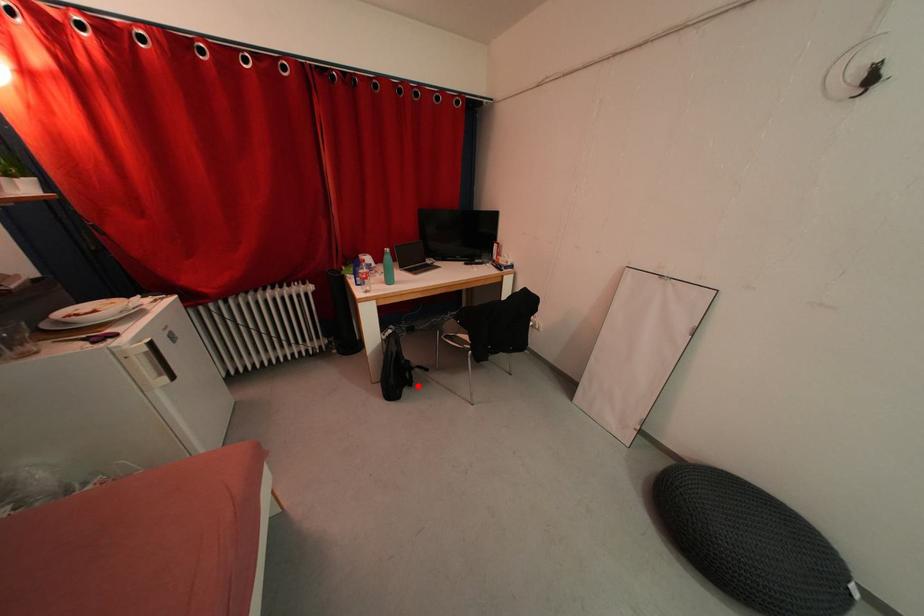
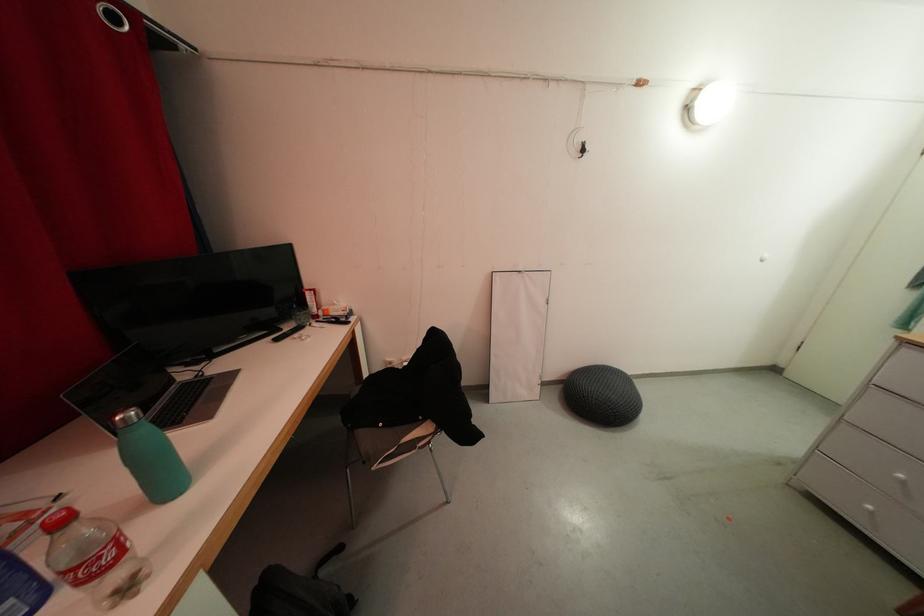
Question: I am providing you with two images of the same scene from different viewpoints. In image1, a red point is highlighted. Considering the same 3D point in image2, which of the following is correct?

Choices:
 (A) It is closer
 (B) It is farther

Answer: (B)